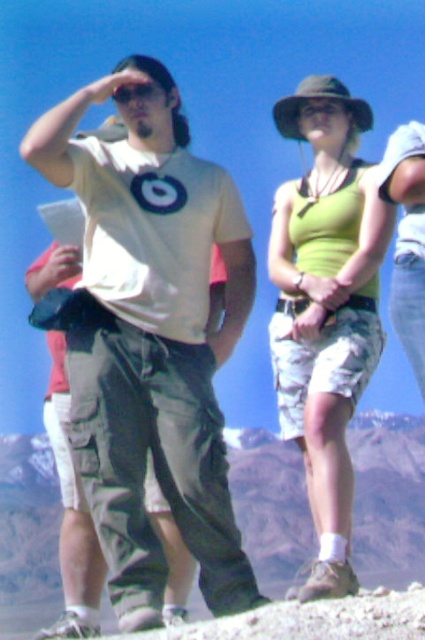
Can you confirm if gray rock formation at center is positioned above matte black sunglasses at upper left?

No, gray rock formation at center is not above matte black sunglasses at upper left.

Between gray rock formation at center and matte black sunglasses at upper left, which one has more height?

gray rock formation at center

This screenshot has width=425, height=640. Describe the element at coordinates (388, 497) in the screenshot. I see `gray rock formation at center` at that location.

Find the location of a particular element. The image size is (425, 640). gray rock formation at center is located at coordinates (388, 497).

Is matte khaki pants at center to the left of matte black sunglasses at upper left from the viewer's perspective?

No, matte khaki pants at center is not to the left of matte black sunglasses at upper left.

Does matte khaki pants at center appear over matte black sunglasses at upper left?

Actually, matte khaki pants at center is below matte black sunglasses at upper left.

Locate an element on the screen. This screenshot has width=425, height=640. matte khaki pants at center is located at coordinates (149, 339).

The height and width of the screenshot is (640, 425). I want to click on matte khaki pants at center, so click(149, 339).

Where is `matte khaki pants at center`? The height and width of the screenshot is (640, 425). matte khaki pants at center is located at coordinates (149, 339).

In the scene shown: Does matte khaki pants at center have a smaller size compared to green fabric tank top at center?

Actually, matte khaki pants at center might be larger than green fabric tank top at center.

Is point (112, 182) in front of point (275, 392)?

Yes, it is in front of point (275, 392).

Locate an element on the screen. The image size is (425, 640). matte khaki pants at center is located at coordinates (149, 339).